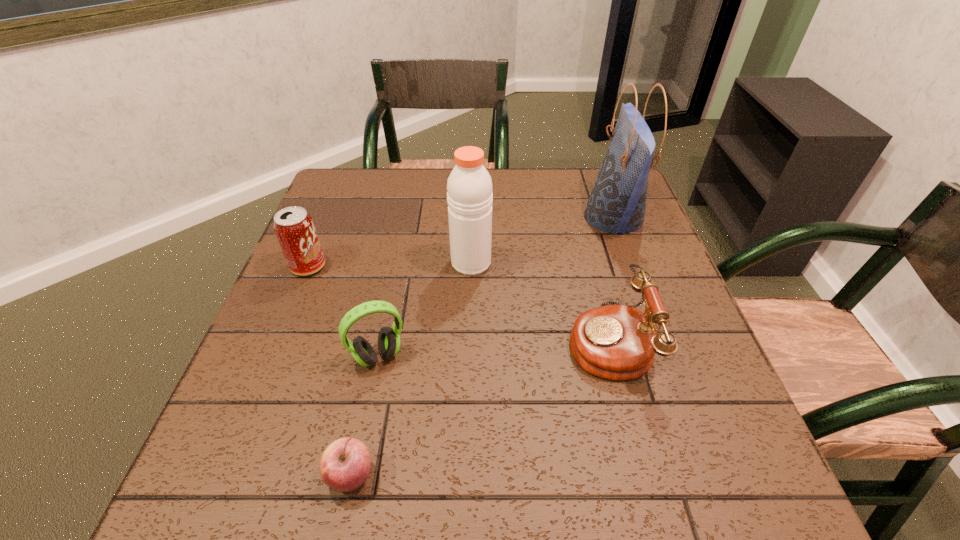
The height and width of the screenshot is (540, 960). I want to click on free space that satisfies the following two spatial constraints: 1. on the front side of the headset; 2. on the left side of the leftmost object, so click(272, 356).

Identify the location of vacant space that satisfies the following two spatial constraints: 1. on the back side of the leftmost object; 2. on the right side of the shaker. (310, 262).

The image size is (960, 540). I want to click on vacant region that satisfies the following two spatial constraints: 1. on the back side of the apple; 2. on the right side of the headset, so [375, 356].

In order to click on vacant region that satisfies the following two spatial constraints: 1. on the front side of the soda can; 2. on the right side of the headset in this screenshot , I will do `click(272, 356)`.

Where is `free location that satisfies the following two spatial constraints: 1. on the dial of the telephone; 2. on the front side of the apple`? The height and width of the screenshot is (540, 960). free location that satisfies the following two spatial constraints: 1. on the dial of the telephone; 2. on the front side of the apple is located at coordinates (644, 476).